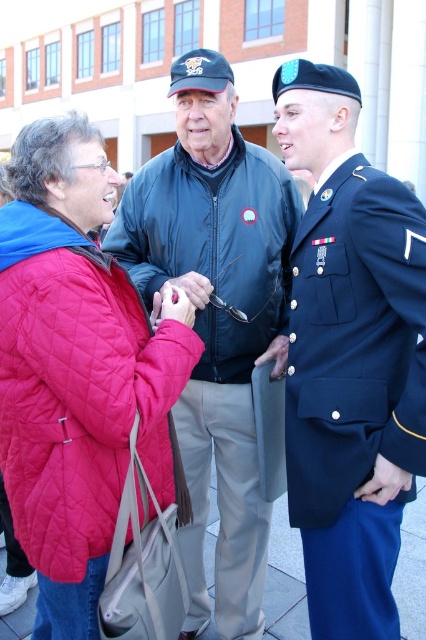
Question: Among these objects, which one is nearest to the camera?

Choices:
 (A) dark blue quilted jacket at center
 (B) matte black jacket at center
 (C) quilted red jacket at left

Answer: (C)

Question: Which is nearer to the dark blue quilted jacket at center?

Choices:
 (A) quilted red jacket at left
 (B) matte black jacket at center

Answer: (B)

Question: Can you confirm if quilted red jacket at left is wider than dark blue quilted jacket at center?

Choices:
 (A) yes
 (B) no

Answer: (B)

Question: Can you confirm if navy blue fabric uniform at right is wider than dark blue quilted jacket at center?

Choices:
 (A) no
 (B) yes

Answer: (A)

Question: Does navy blue fabric uniform at right have a lesser width compared to dark blue quilted jacket at center?

Choices:
 (A) no
 (B) yes

Answer: (B)

Question: Which point is farther to the camera?

Choices:
 (A) navy blue fabric uniform at right
 (B) quilted red jacket at left

Answer: (A)